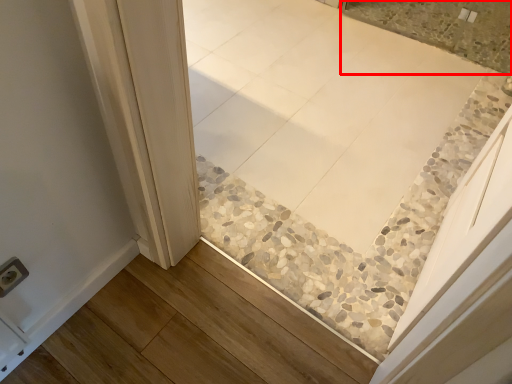
Question: From the image's perspective, what is the correct spatial relationship of tile (annotated by the red box) in relation to electric outlet?

Choices:
 (A) above
 (B) below

Answer: (A)